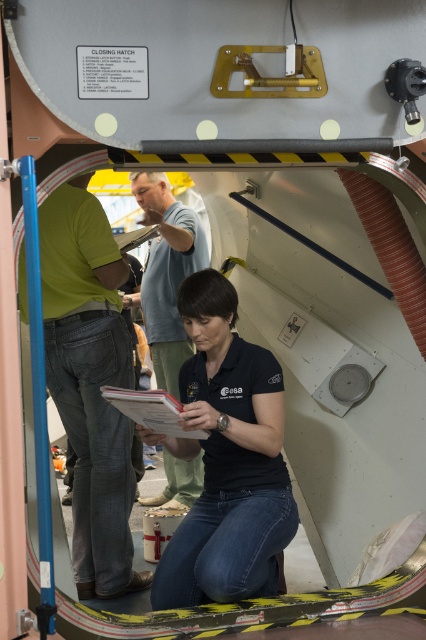
You are an astronaut inside the spacecraft and need to determine the distance between two points marked on the hatch. The points are labeled as point [144,429] and point [152,404]. Which point is closer to you, the astronaut, when you are facing the hatch?

Point [144,429] is further to the camera than point [152,404], so the point closer to you is point [152,404].

You are an astronaut inside the spacecraft. You need to reach the hatch control panel located at point (49, 248). The ESA logo on your suit is at point 0.65, 0.45. Can you safely reach the control panel without moving more than 3 meters from your current position?

The distance between you and the hatch control panel at point (49, 248) is 2.95 meters, so yes, you can safely reach it without exceeding the 3 meter limit.